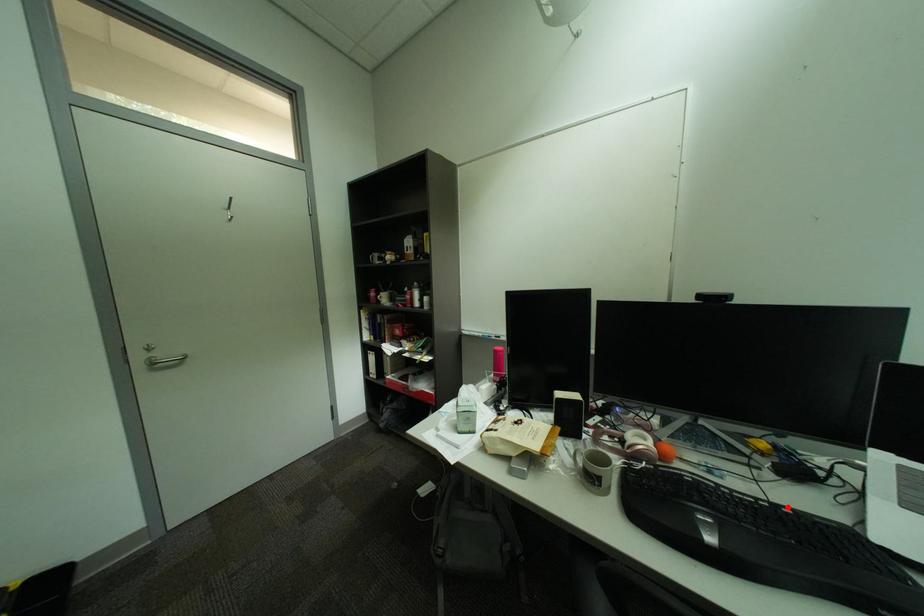
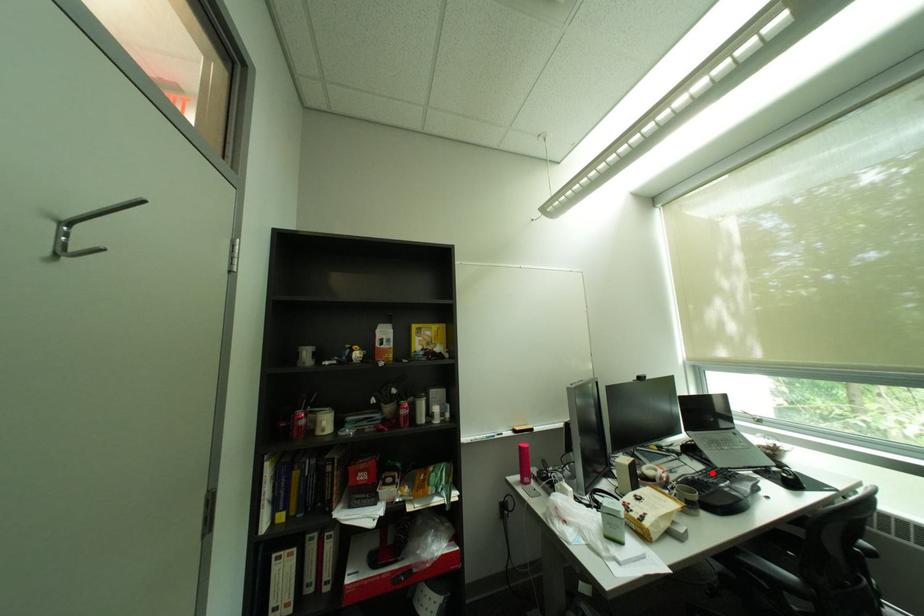
Based on the photo, I am providing you with two images of the same scene from different viewpoints. A red point is marked on the first image and another point is marked on the second image. Is the red point in image1 aligned with the point shown in image2?

Yes